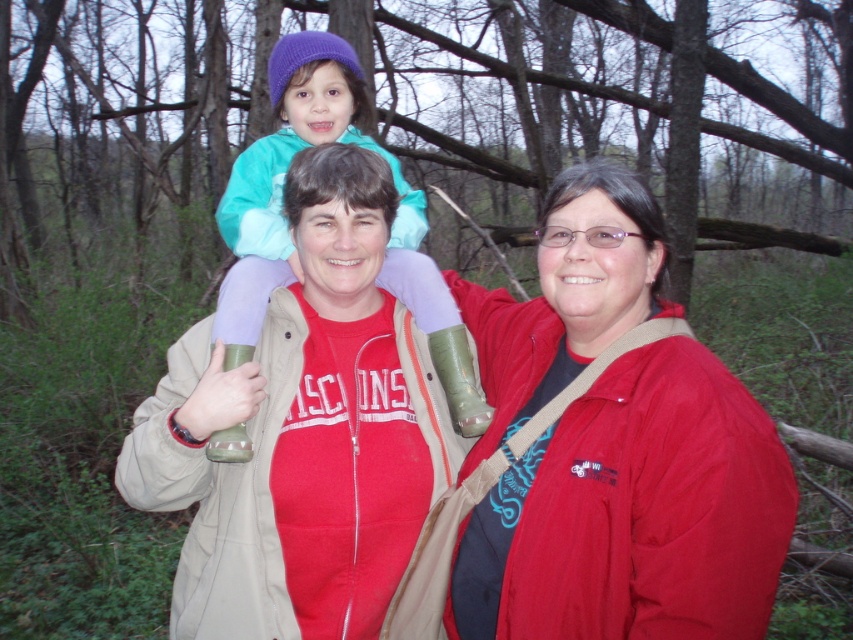
Question: Can you confirm if matte red jacket at center is positioned above turquoise fleece jacket at center?

Choices:
 (A) yes
 (B) no

Answer: (B)

Question: Can you confirm if matte red jacket at center is smaller than matte green rubber boots at center?

Choices:
 (A) yes
 (B) no

Answer: (B)

Question: Among these points, which one is farthest from the camera?

Choices:
 (A) (618, 243)
 (B) (302, 595)
 (C) (293, 259)

Answer: (C)

Question: Is matte red jacket at center above turquoise fleece jacket at center?

Choices:
 (A) no
 (B) yes

Answer: (A)

Question: Which object is the closest to the matte red jacket at center?

Choices:
 (A) matte green rubber boots at center
 (B) turquoise fleece jacket at center

Answer: (A)

Question: Based on their relative distances, which object is farther from the turquoise fleece jacket at center?

Choices:
 (A) matte red jacket at center
 (B) matte green rubber boots at center

Answer: (A)